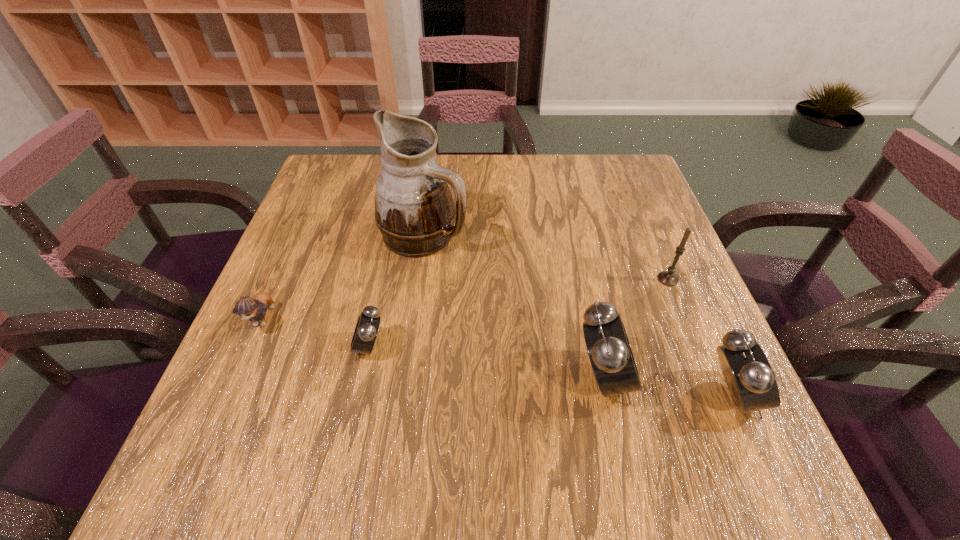
At what (x,y) coordinates should I click in order to perform the action: click on vacant area located on the face of the fourth object from left to right. Please return your answer as a coordinate pair (x, y). Image resolution: width=960 pixels, height=540 pixels. Looking at the image, I should click on (668, 377).

What are the coordinates of `free space located on the front of the second farthest object` in the screenshot? It's located at (702, 362).

You are a GUI agent. You are given a task and a screenshot of the screen. Output one action in this format:
    pyautogui.click(x=<x>, y=<y>)
    Task: Click on the vacant space located 0.080m from the spout of the pitcher
    This screenshot has width=960, height=540.
    Given the screenshot: What is the action you would take?
    pyautogui.click(x=502, y=235)

This screenshot has width=960, height=540. I want to click on vacant space located on the front-facing side of the leftmost object, so (x=231, y=392).

Image resolution: width=960 pixels, height=540 pixels. Find the location of `object located at the left edge`. object located at the left edge is located at coordinates (247, 308).

Where is `alarm clock that is positioned at the right edge`? This screenshot has width=960, height=540. alarm clock that is positioned at the right edge is located at coordinates (750, 379).

At what (x,y) coordinates should I click in order to perform the action: click on candle at the right edge. Please return your answer as a coordinate pair (x, y). Image resolution: width=960 pixels, height=540 pixels. Looking at the image, I should click on (668, 278).

The image size is (960, 540). I want to click on object that is at the near right corner, so click(x=750, y=379).

Identify the location of vacant area at the far edge. The height and width of the screenshot is (540, 960). (381, 167).

In the image, there is a desktop. At what (x,y) coordinates should I click in order to perform the action: click on blank space at the near edge. Please return your answer as a coordinate pair (x, y). Looking at the image, I should click on (593, 413).